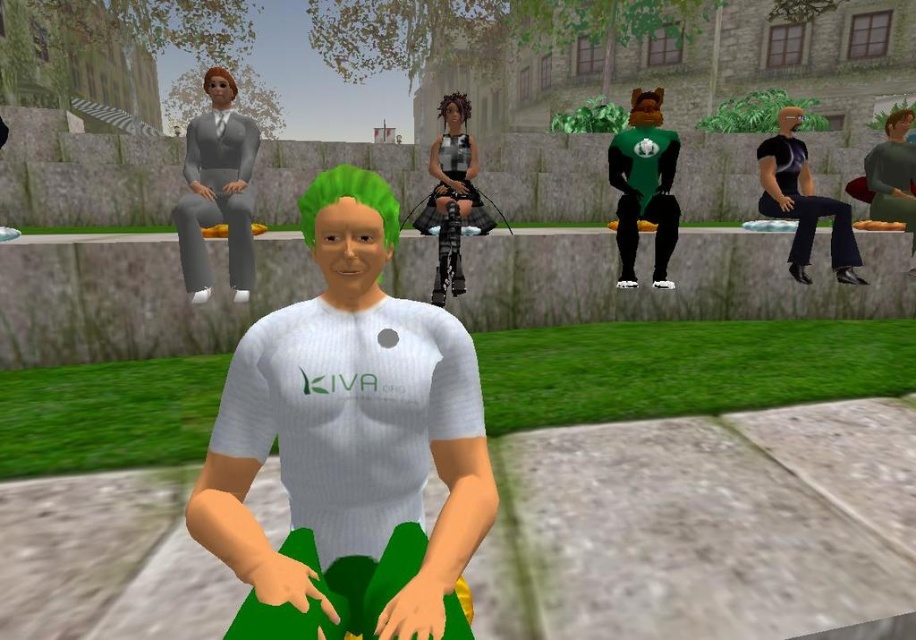
Looking at this image, between matte gray suit at left and shiny brown hair at center, which one has more height?

shiny brown hair at center is taller.

Who is higher up, matte gray suit at left or shiny brown hair at center?

Positioned higher is shiny brown hair at center.

From the picture: Who is more distant from viewer, (206,131) or (469,108)?

Point (469,108)

Where is `matte gray suit at left`? Image resolution: width=916 pixels, height=640 pixels. matte gray suit at left is located at coordinates (217, 188).

Who is positioned more to the right, green matte t-shirt at right or brown leather bag at right?

From the viewer's perspective, brown leather bag at right appears more on the right side.

Does green matte t-shirt at right have a greater height compared to brown leather bag at right?

Indeed, green matte t-shirt at right has a greater height compared to brown leather bag at right.

Between point (647, 198) and point (895, 180), which one is positioned behind?

The point (895, 180) is more distant.

This screenshot has width=916, height=640. Identify the location of green matte t-shirt at right. (644, 186).

Which is more to the left, white ribbed shirt at center or plaid fabric skirt at center?

Positioned to the left is white ribbed shirt at center.

Is point (456, 426) less distant than point (454, 220)?

Yes.

Find the location of `white ribbed shirt at center`. white ribbed shirt at center is located at coordinates 349,444.